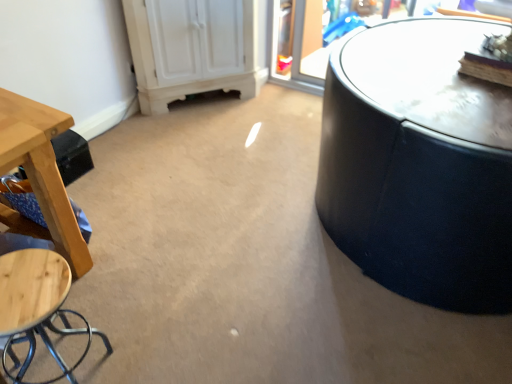
Question: Is wooden stool at lower left wider than wooden stool at left?

Choices:
 (A) yes
 (B) no

Answer: (B)

Question: Considering the relative sizes of wooden stool at lower left and wooden stool at left in the image provided, is wooden stool at lower left bigger than wooden stool at left?

Choices:
 (A) yes
 (B) no

Answer: (B)

Question: Can you confirm if wooden stool at lower left is smaller than wooden stool at left?

Choices:
 (A) no
 (B) yes

Answer: (B)

Question: Is wooden stool at lower left shorter than wooden stool at left?

Choices:
 (A) no
 (B) yes

Answer: (A)

Question: From the image's perspective, is wooden stool at lower left located above wooden stool at left?

Choices:
 (A) no
 (B) yes

Answer: (A)

Question: Is wooden stool at lower left outside of wooden stool at left?

Choices:
 (A) yes
 (B) no

Answer: (A)

Question: Is wooden stool at left smaller than wooden stool at lower left?

Choices:
 (A) no
 (B) yes

Answer: (A)

Question: Does wooden stool at left have a lesser width compared to wooden stool at lower left?

Choices:
 (A) yes
 (B) no

Answer: (B)

Question: From the image's perspective, is wooden stool at left over wooden stool at lower left?

Choices:
 (A) yes
 (B) no

Answer: (A)

Question: Is wooden stool at left at the left side of wooden stool at lower left?

Choices:
 (A) yes
 (B) no

Answer: (A)

Question: Considering the relative sizes of wooden stool at left and wooden stool at lower left in the image provided, is wooden stool at left shorter than wooden stool at lower left?

Choices:
 (A) yes
 (B) no

Answer: (A)

Question: Can you confirm if wooden stool at left is positioned to the right of wooden stool at lower left?

Choices:
 (A) no
 (B) yes

Answer: (A)

Question: Is wooden stool at left to the left or to the right of wooden stool at lower left in the image?

Choices:
 (A) right
 (B) left

Answer: (B)